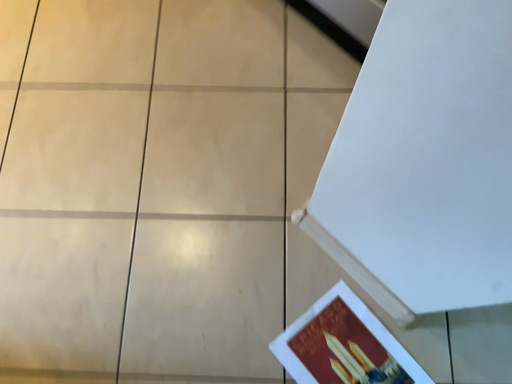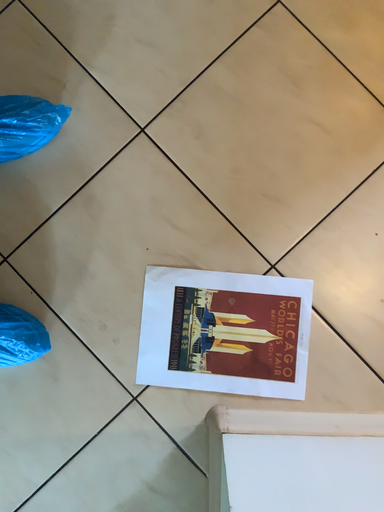
Question: Which way did the camera rotate in the video?

Choices:
 (A) rotated downward
 (B) rotated upward

Answer: (B)